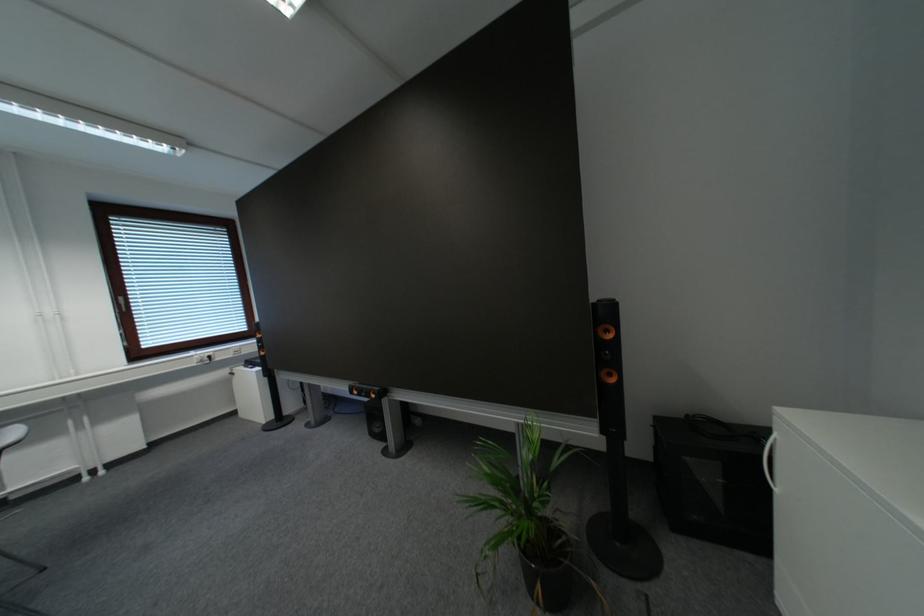
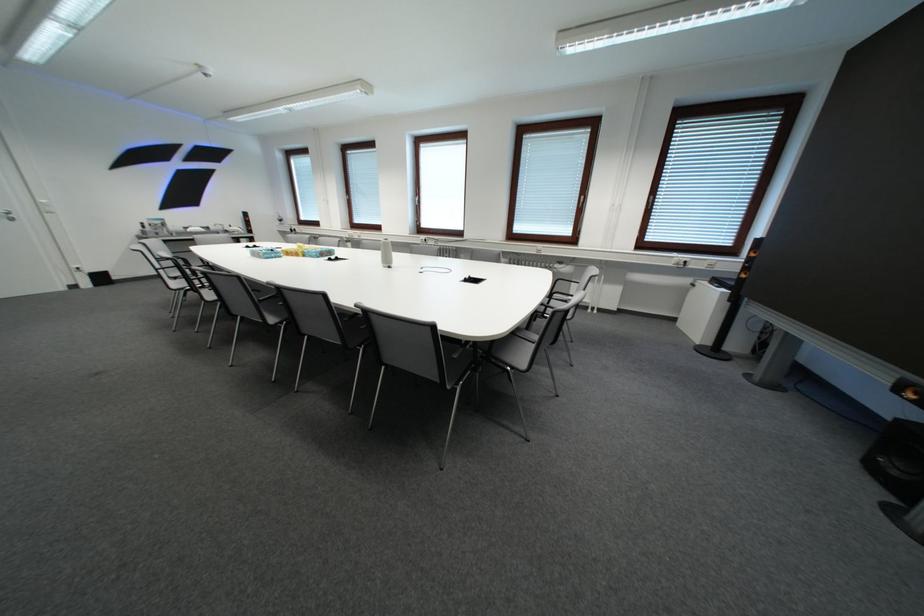
In the scene shown: The first image is from the beginning of the video and the second image is from the end. How did the camera likely rotate when shooting the video?

The camera's rotation is toward left-down.